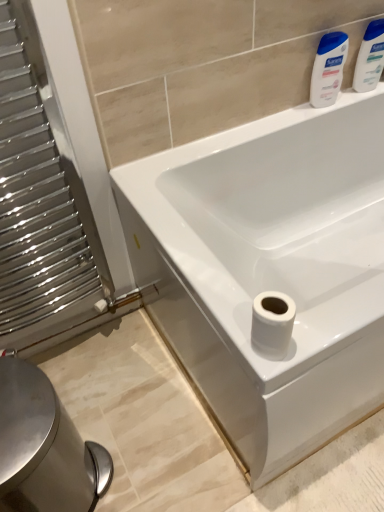
This screenshot has height=512, width=384. Find the location of `vacant space that is to the left of white glossy lotion at upper right, positioned as the 2th cleaning product in right-to-left order`. vacant space that is to the left of white glossy lotion at upper right, positioned as the 2th cleaning product in right-to-left order is located at coordinates (280, 120).